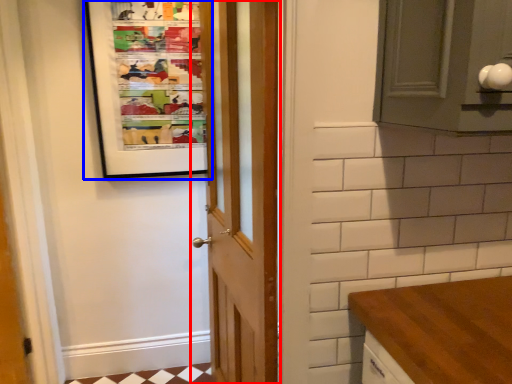
Question: Which of the following is the farthest to the observer, door (highlighted by a red box) or bulletin board (highlighted by a blue box)?

Choices:
 (A) door
 (B) bulletin board

Answer: (B)